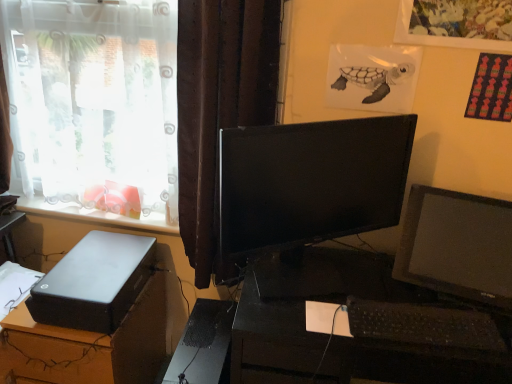
Locate an element on the screen. free location above white plastic window sill at lower left (from a real-world perspective) is located at coordinates (95, 207).